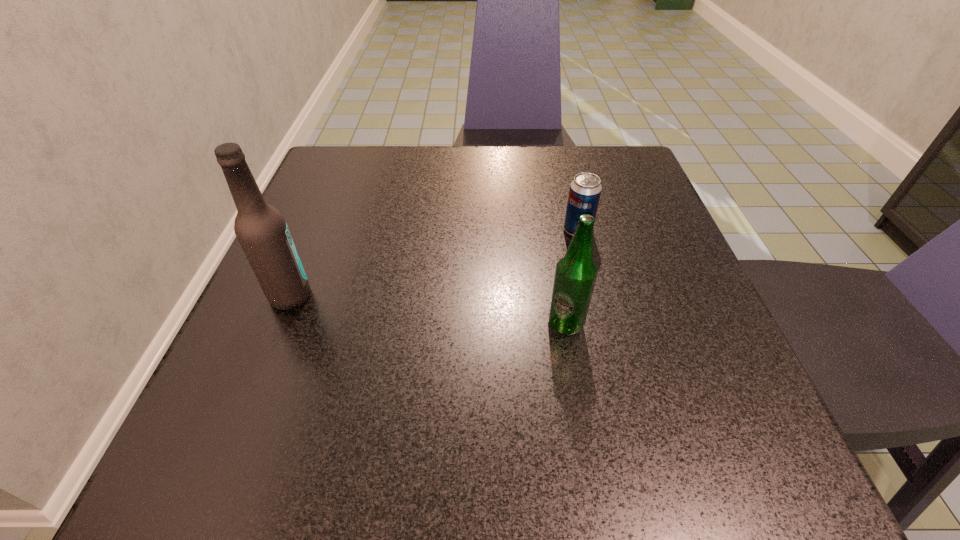
At what (x,y) coordinates should I click in order to perform the action: click on the taller beer bottle. Please return your answer as a coordinate pair (x, y). Looking at the image, I should click on (261, 230).

This screenshot has width=960, height=540. Find the location of `the left beer bottle`. the left beer bottle is located at coordinates (261, 230).

This screenshot has width=960, height=540. What are the coordinates of `the second tallest object` in the screenshot? It's located at click(575, 275).

I want to click on the right beer bottle, so click(x=575, y=275).

Image resolution: width=960 pixels, height=540 pixels. Identify the location of beer can. (585, 190).

What are the coordinates of `the farthest object` in the screenshot? It's located at (585, 190).

The height and width of the screenshot is (540, 960). In order to click on vacant space situated on the label of the left beer bottle in this screenshot , I will do `click(483, 296)`.

The height and width of the screenshot is (540, 960). Find the location of `vacant region located on the label of the right beer bottle`. vacant region located on the label of the right beer bottle is located at coordinates (588, 454).

Locate an element on the screen. This screenshot has width=960, height=540. vacant space positioned 0.230m on the left of the farthest object is located at coordinates (446, 230).

Locate an element on the screen. This screenshot has width=960, height=540. object that is at the left edge is located at coordinates (261, 230).